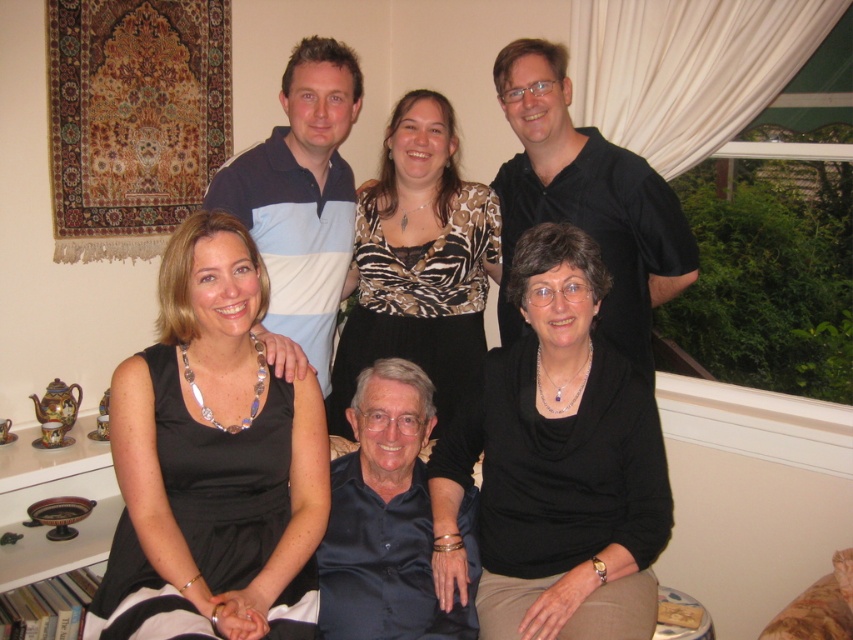
Who is shorter, black satin dress at center or black silk dress at upper center?

With less height is black satin dress at center.

Who is taller, black satin dress at center or black silk dress at upper center?

black silk dress at upper center

Which is behind, point (163, 356) or point (447, 124)?

Point (447, 124)

The image size is (853, 640). Find the location of `black satin dress at center`. black satin dress at center is located at coordinates (212, 461).

Image resolution: width=853 pixels, height=640 pixels. What do you see at coordinates (212, 461) in the screenshot?
I see `black satin dress at center` at bounding box center [212, 461].

Does black satin dress at center have a larger size compared to zebra print blouse at center?

Actually, black satin dress at center might be smaller than zebra print blouse at center.

Between point (161, 404) and point (463, 301), which one is positioned in front?

Point (161, 404) is more forward.

You are a GUI agent. You are given a task and a screenshot of the screen. Output one action in this format:
    pyautogui.click(x=<x>, y=<y>)
    Task: Click on the black satin dress at center
    This screenshot has width=853, height=640.
    Given the screenshot: What is the action you would take?
    pyautogui.click(x=212, y=461)

Consider the image. Measure the distance between point (646,593) and camera.

Point (646,593) is 5.65 feet from camera.

Can you confirm if black matte sweater at lower center is taller than zebra print blouse at center?

No, black matte sweater at lower center is not taller than zebra print blouse at center.

Identify the location of black matte sweater at lower center. The image size is (853, 640). (555, 465).

You are a GUI agent. You are given a task and a screenshot of the screen. Output one action in this format:
    pyautogui.click(x=<x>, y=<y>)
    Task: Click on the black matte sweater at lower center
    Image resolution: width=853 pixels, height=640 pixels.
    Given the screenshot: What is the action you would take?
    pyautogui.click(x=555, y=465)